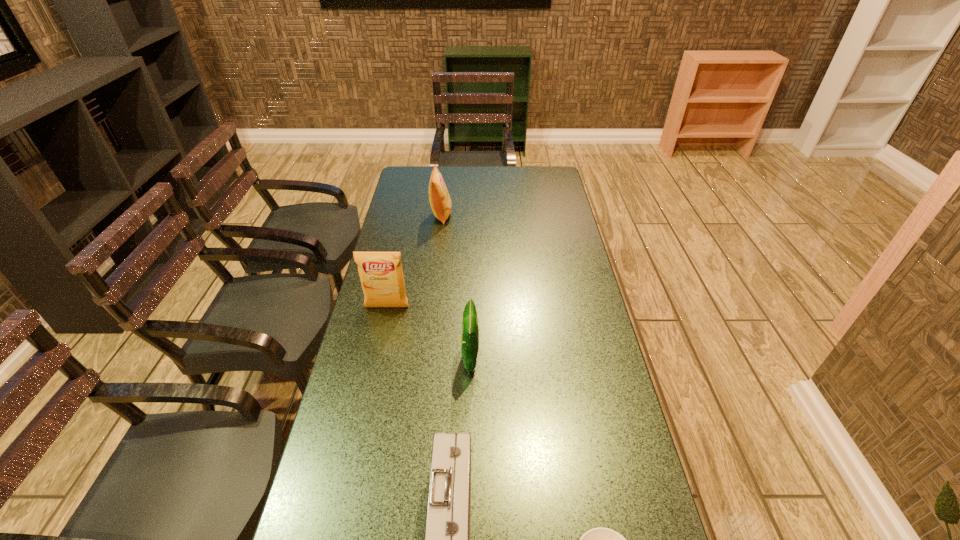
The image size is (960, 540). I want to click on the leftmost object, so click(381, 275).

Locate an element on the screen. The height and width of the screenshot is (540, 960). the leftmost crisp (potato chip) is located at coordinates (381, 275).

Where is `the farthest object`? Image resolution: width=960 pixels, height=540 pixels. the farthest object is located at coordinates (439, 198).

At what (x,y) coordinates should I click in order to perform the action: click on the second crisp (potato chip) from right to left. Please return your answer as a coordinate pair (x, y). Image resolution: width=960 pixels, height=540 pixels. Looking at the image, I should click on (439, 198).

Identify the location of the nearest crisp (potato chip). This screenshot has height=540, width=960. (470, 331).

At what (x,y) coordinates should I click in order to perform the action: click on the rightmost crisp (potato chip). Please return your answer as a coordinate pair (x, y). The width and height of the screenshot is (960, 540). Looking at the image, I should click on (470, 331).

This screenshot has width=960, height=540. Find the location of `free space located on the front of the second farthest object with the logo`. free space located on the front of the second farthest object with the logo is located at coordinates (364, 413).

Find the location of a particular element. Image resolution: width=960 pixels, height=540 pixels. free space located on the front-facing side of the farthest object is located at coordinates (516, 215).

Identify the location of vacant point located 0.330m on the front-facing side of the rightmost crisp (potato chip). This screenshot has width=960, height=540. (591, 358).

This screenshot has height=540, width=960. Identify the location of object positioned at the left edge. (381, 275).